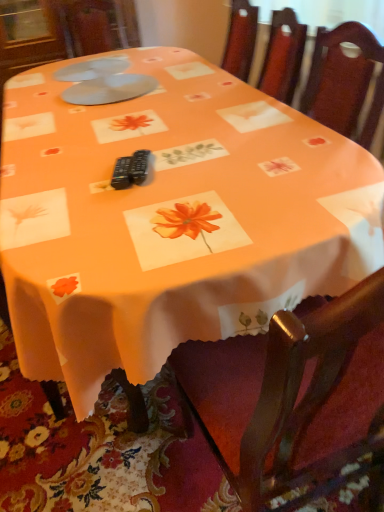
Where is `free spot to the right of white plastic plates at upper center, the 2th tableware from the front`? This screenshot has height=512, width=384. free spot to the right of white plastic plates at upper center, the 2th tableware from the front is located at coordinates (170, 60).